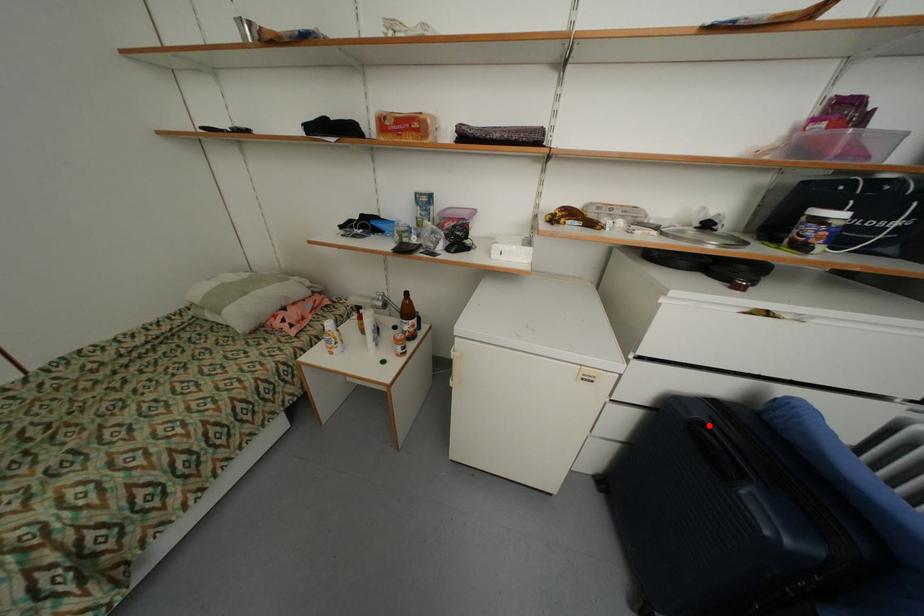
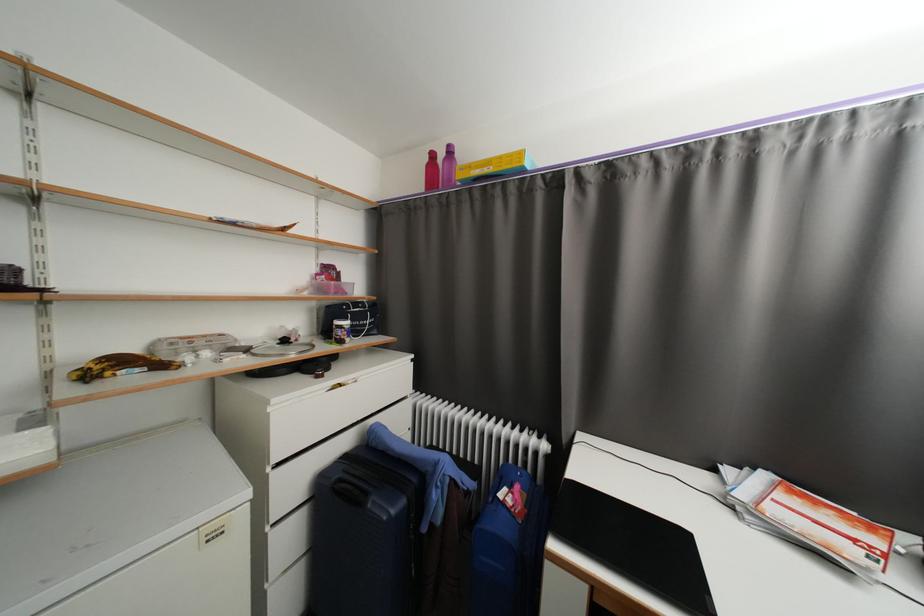
Question: I am providing you with two images of the same scene from different viewpoints. A red point is marked on the first image. At the location where the point appears in image 1, is it still visible in image 2?

Choices:
 (A) Yes
 (B) No

Answer: (A)